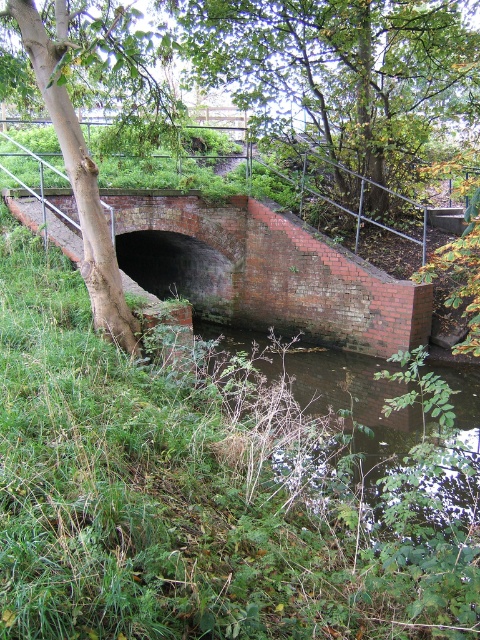
Question: Which of these objects is positioned farthest from the brick at center?

Choices:
 (A) green leafy tree at upper center
 (B) green rough bark tree at left

Answer: (B)

Question: Is green leafy tree at upper center to the right of green rough bark tree at left from the viewer's perspective?

Choices:
 (A) no
 (B) yes

Answer: (B)

Question: Does green leafy tree at upper center appear over brick at center?

Choices:
 (A) yes
 (B) no

Answer: (A)

Question: Based on their relative distances, which object is nearer to the green rough bark tree at left?

Choices:
 (A) brick at center
 (B) green leafy tree at upper center

Answer: (A)

Question: Which object is closer to the camera taking this photo?

Choices:
 (A) green rough bark tree at left
 (B) brick at center
 (C) green leafy tree at upper center

Answer: (A)

Question: Is green leafy tree at upper center below brick at center?

Choices:
 (A) yes
 (B) no

Answer: (B)